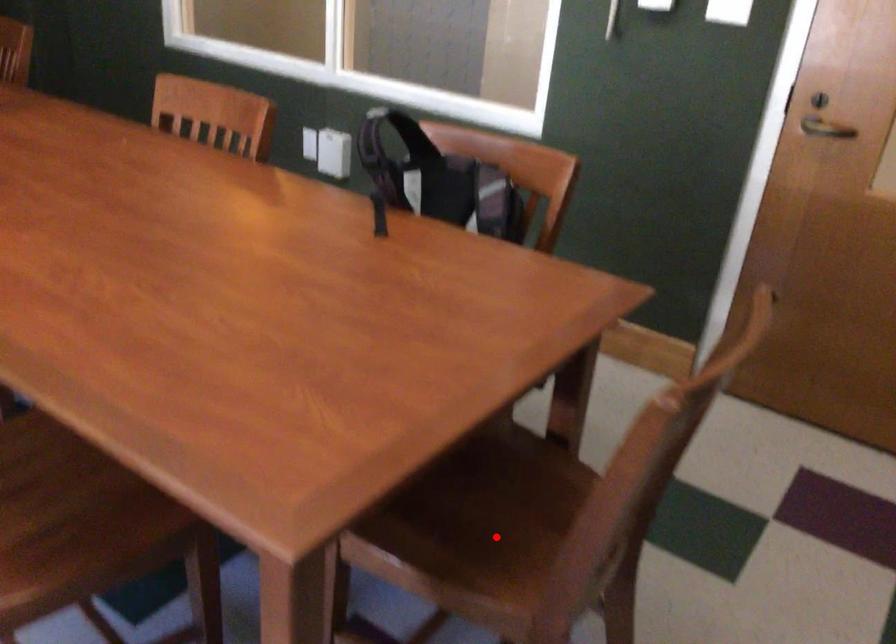
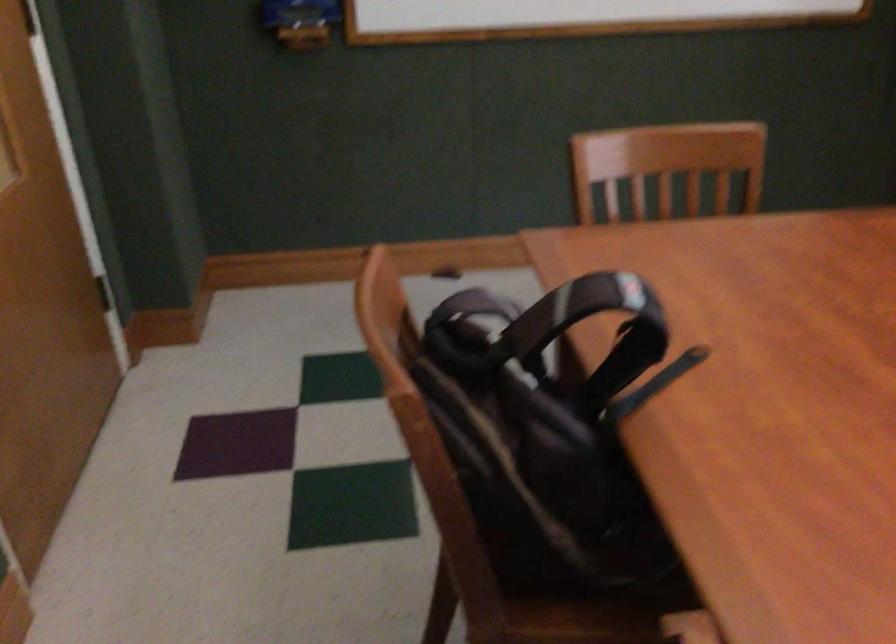
Question: I am providing you with two images of the same scene from different viewpoints. A red point is marked on the first image. Is the red point's position out of view in image 2?

Choices:
 (A) Yes
 (B) No

Answer: (A)